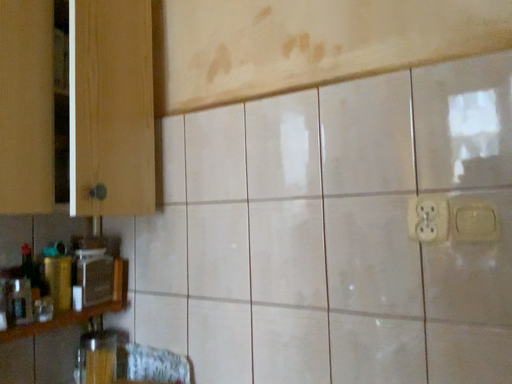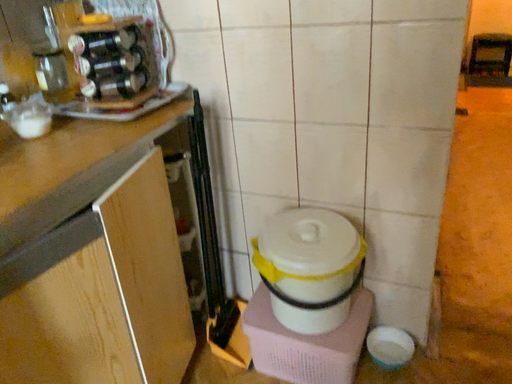
Question: How did the camera likely rotate when shooting the video?

Choices:
 (A) rotated right
 (B) rotated left

Answer: (A)